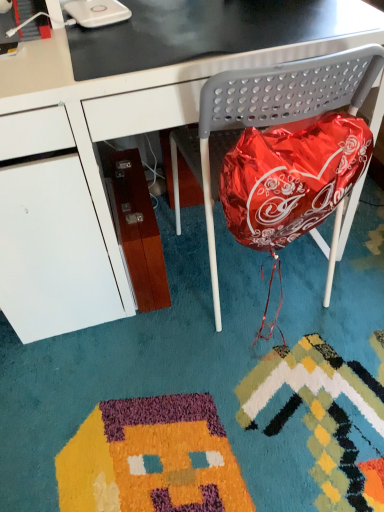
Locate an element on the screen. The height and width of the screenshot is (512, 384). vacant area situated to the left side of metallic gray folding chair at center is located at coordinates (156, 313).